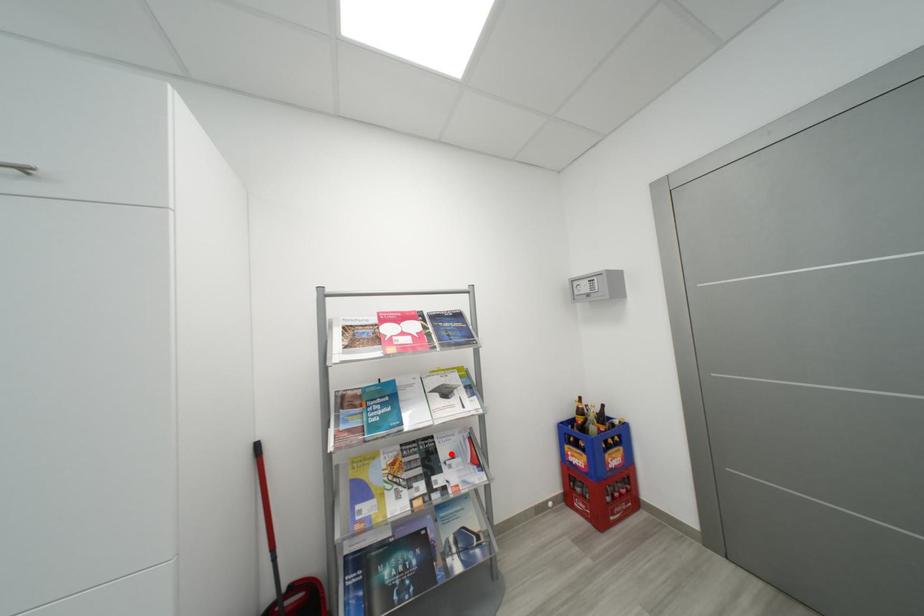
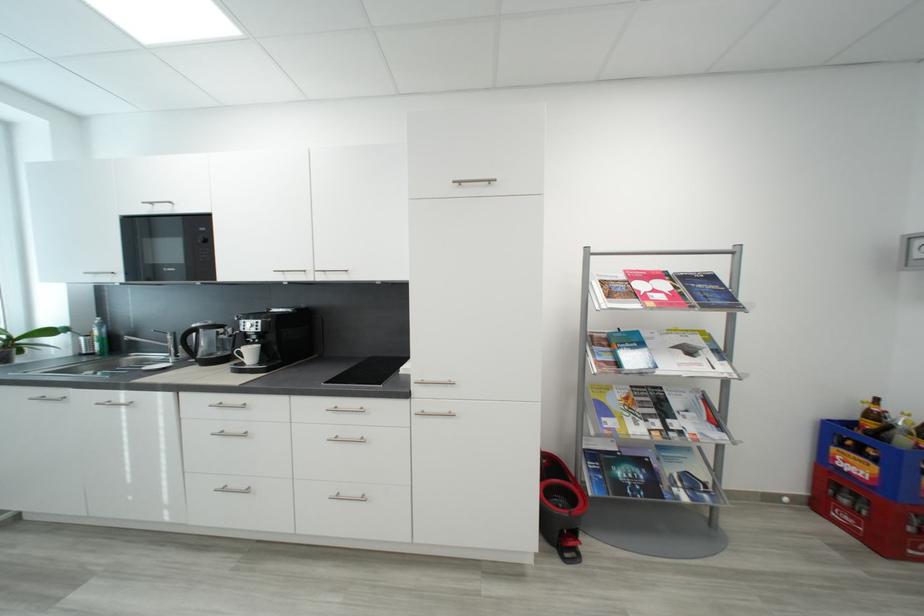
The point at the highlighted location is marked in the first image. Where is the corresponding point in the second image?

(684, 406)